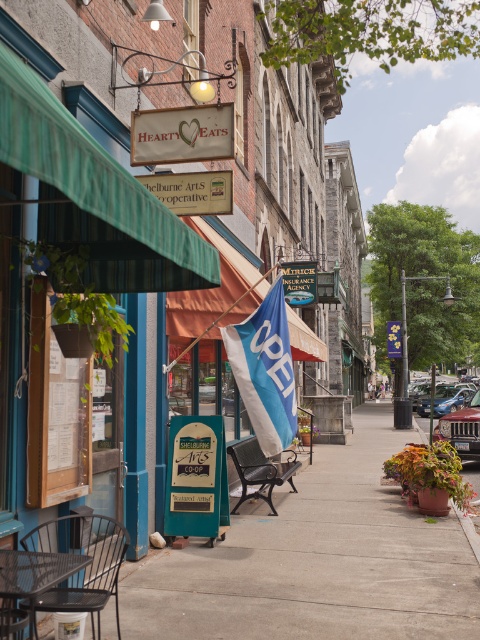
You are a delivery person trying to park your 2.5 meter tall delivery robot in this street scene. The robot needs to fit vertically between the concrete sidewalk at center and the green striped awning at upper left. Can the robot park there?

The concrete sidewalk at center is taller than the green striped awning at upper left, so the vertical space between them is insufficient for the 2.5 meter tall delivery robot to park there.

You are a delivery person with a 3.5 feet wide cart. You need to move from the left side of the image to the right side, passing through the area where the concrete sidewalk at center and blue fabric flag at center are located. Can your cart fit through the space between them?

The concrete sidewalk at center and blue fabric flag at center are 8.14 feet apart, which is wider than the cart width of 3.5 feet. Therefore, the cart can fit through the space between them.

You are a customer looking for the entrance to Hearty Eats. You see a wooden menu at left and a blue fabric flag at center. Which object is closer to the entrance of Hearty Eats?

The wooden menu at left is closer to the entrance of Hearty Eats because it is located below the blue fabric flag at center, meaning it is positioned lower and nearer to the entrance area.